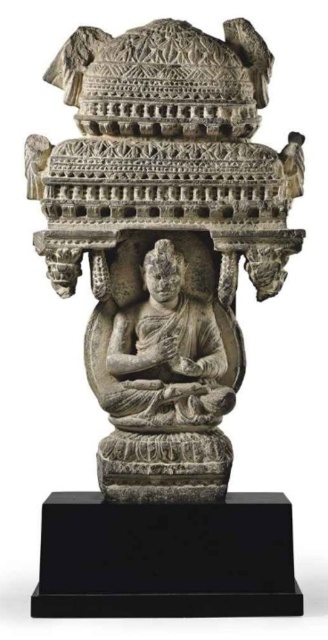
Measure the distance between stone statue at center and gray stone buddha at center.

A distance of 3.19 inches exists between stone statue at center and gray stone buddha at center.

Is stone statue at center positioned at the back of gray stone buddha at center?

That is False.

Where is `stone statue at center`? The height and width of the screenshot is (640, 328). stone statue at center is located at coordinates (164, 236).